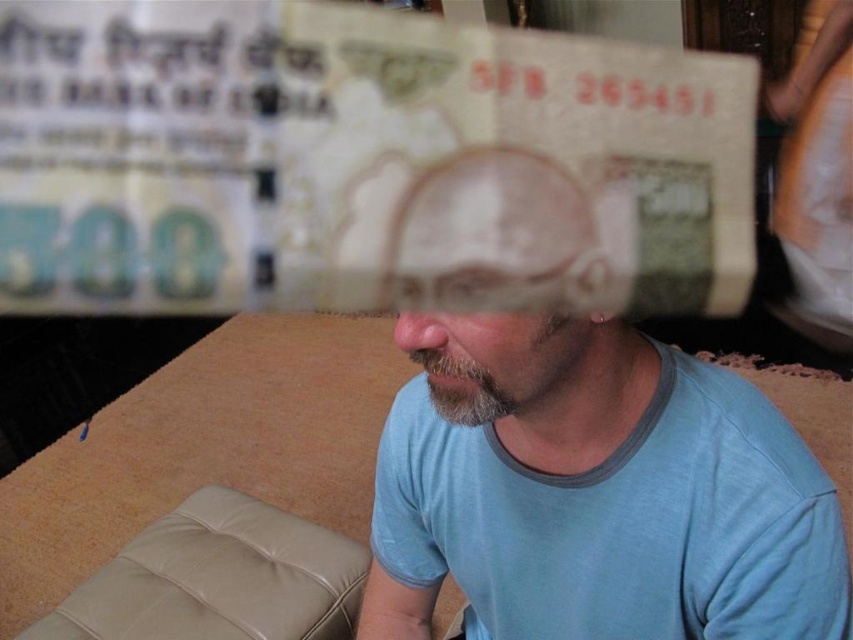
Question: Observing the image, what is the correct spatial positioning of light brown paper currency at upper center in reference to matte paper currency at center?

Choices:
 (A) right
 (B) left

Answer: (B)

Question: Among these points, which one is farthest from the camera?

Choices:
 (A) (633, 618)
 (B) (177, 209)

Answer: (A)

Question: Does light brown paper currency at upper center have a larger size compared to matte paper currency at center?

Choices:
 (A) no
 (B) yes

Answer: (B)

Question: Does light brown paper currency at upper center appear on the right side of matte paper currency at center?

Choices:
 (A) no
 (B) yes

Answer: (A)

Question: Which point is closer to the camera?

Choices:
 (A) (770, 440)
 (B) (165, 132)

Answer: (B)

Question: Among these objects, which one is nearest to the camera?

Choices:
 (A) light brown paper currency at upper center
 (B) matte paper currency at center

Answer: (A)